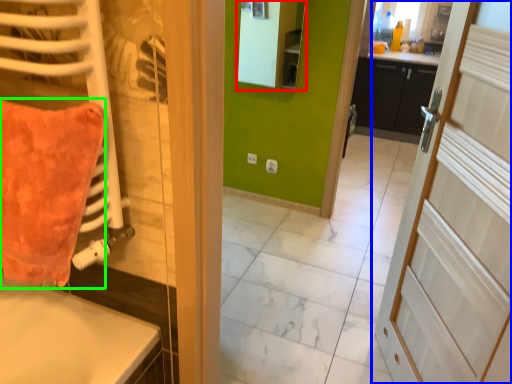
Question: Which object is the closest to the mirror (highlighted by a red box)? Choose among these: door (highlighted by a blue box) or throw pillow (highlighted by a green box).

Choices:
 (A) door
 (B) throw pillow

Answer: (A)